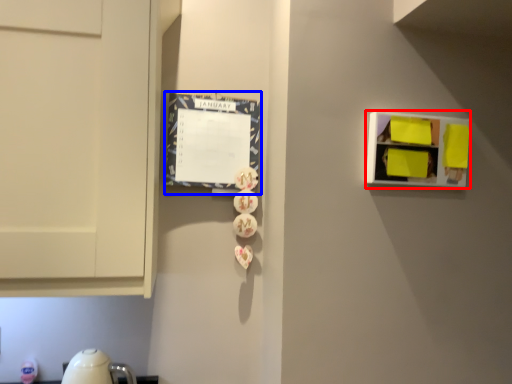
Question: Among these objects, which one is farthest to the camera, shelf (highlighted by a red box) or bulletin board (highlighted by a blue box)?

Choices:
 (A) shelf
 (B) bulletin board

Answer: (B)